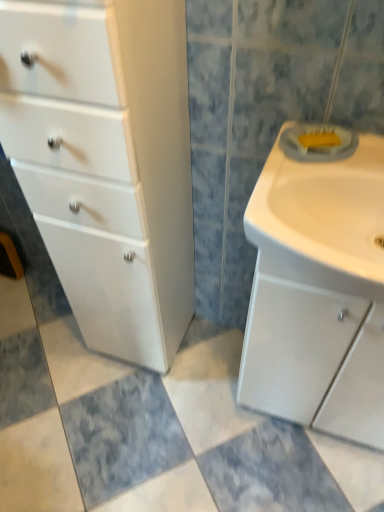
Where is `white glossy cabinet at left`? Image resolution: width=384 pixels, height=512 pixels. white glossy cabinet at left is located at coordinates 106,163.

The image size is (384, 512). I want to click on white glossy cabinet at left, so click(106, 163).

Can you confirm if white matte sink cabinet at right is shorter than white glossy sink at right?

No.

Which is nearer, [358,342] or [326,259]?

Point [326,259]

Considering the positions of objects white matte sink cabinet at right and white glossy sink at right in the image provided, who is more to the right, white matte sink cabinet at right or white glossy sink at right?

white matte sink cabinet at right is more to the right.

Is point (322, 406) closer or farther from the camera than point (148, 67)?

Point (322, 406).

From a real-world perspective, is white matte sink cabinet at right beneath white glossy cabinet at left?

Yes, from a real-world perspective, white matte sink cabinet at right is below white glossy cabinet at left.

Is white matte sink cabinet at right oriented towards white glossy cabinet at left?

No, white matte sink cabinet at right is not oriented towards white glossy cabinet at left.

Is white matte sink cabinet at right positioned far away from white glossy cabinet at left?

No, white matte sink cabinet at right is in close proximity to white glossy cabinet at left.

Considering the sizes of objects white glossy sink at right and white matte sink cabinet at right in the image provided, who is shorter, white glossy sink at right or white matte sink cabinet at right?

white glossy sink at right is shorter.

Looking at this image, from a real-world perspective, is white glossy sink at right above or below white matte sink cabinet at right?

In terms of real-world spatial position, white glossy sink at right is above white matte sink cabinet at right.

Image resolution: width=384 pixels, height=512 pixels. Find the location of `sink above the white matte sink cabinet at right (from the image's perspective)`. sink above the white matte sink cabinet at right (from the image's perspective) is located at coordinates (324, 216).

From the image's perspective, is white glossy cabinet at left above or below white glossy sink at right?

white glossy cabinet at left is below white glossy sink at right.

From a real-world perspective, which object rests below the other?

From a 3D spatial view, white glossy cabinet at left is below.

What's the angular difference between white glossy cabinet at left and white glossy sink at right's facing directions?

There is a 0.463-degree angle between the facing directions of white glossy cabinet at left and white glossy sink at right.

Is white glossy cabinet at left turned away from white glossy sink at right?

That's not correct — white glossy cabinet at left is not looking away from white glossy sink at right.

The width and height of the screenshot is (384, 512). What are the coordinates of `sink above the white glossy cabinet at left (from the image's perspective)` in the screenshot? It's located at (324, 216).

Is white glossy sink at right directly adjacent to white glossy cabinet at left?

No, white glossy sink at right is not with white glossy cabinet at left.

Is white glossy sink at right taller than white glossy cabinet at left?

In fact, white glossy sink at right may be shorter than white glossy cabinet at left.

Is point (366, 212) less distant than point (22, 19)?

No, it is behind (22, 19).

Would you say white glossy cabinet at left contains white matte sink cabinet at right?

Definitely not — white matte sink cabinet at right is not inside white glossy cabinet at left.

Between white glossy cabinet at left and white matte sink cabinet at right, which one has smaller width?

white matte sink cabinet at right.

Considering the sizes of objects white glossy cabinet at left and white matte sink cabinet at right in the image provided, who is smaller, white glossy cabinet at left or white matte sink cabinet at right?

With smaller size is white matte sink cabinet at right.

Image resolution: width=384 pixels, height=512 pixels. In order to click on cabinetry behind the white glossy sink at right in this screenshot , I will do `click(313, 354)`.

At what (x,y) coordinates should I click in order to perform the action: click on chest of drawers above the white matte sink cabinet at right (from the image's perspective). Please return your answer as a coordinate pair (x, y). Looking at the image, I should click on (106, 163).

When comparing their distances from white glossy sink at right, does white matte sink cabinet at right or white glossy cabinet at left seem further?

white glossy cabinet at left lies further to white glossy sink at right than the other object.

When comparing their distances from white glossy sink at right, does white glossy cabinet at left or white matte sink cabinet at right seem closer?

Among the two, white matte sink cabinet at right is located nearer to white glossy sink at right.

Considering their positions, is white glossy sink at right positioned further to white matte sink cabinet at right than white glossy cabinet at left?

white glossy cabinet at left.

Estimate the real-world distances between objects in this image. Which object is further from white glossy cabinet at left, white glossy sink at right or white matte sink cabinet at right?

white matte sink cabinet at right is positioned further to the anchor white glossy cabinet at left.

Looking at the image, which one is located further to white matte sink cabinet at right, white glossy cabinet at left or white glossy sink at right?

The object further to white matte sink cabinet at right is white glossy cabinet at left.

Estimate the real-world distances between objects in this image. Which object is closer to white glossy cabinet at left, white matte sink cabinet at right or white glossy sink at right?

The object closer to white glossy cabinet at left is white glossy sink at right.

Where is `sink located between white glossy cabinet at left and white matte sink cabinet at right in the left-right direction`? sink located between white glossy cabinet at left and white matte sink cabinet at right in the left-right direction is located at coordinates (324, 216).